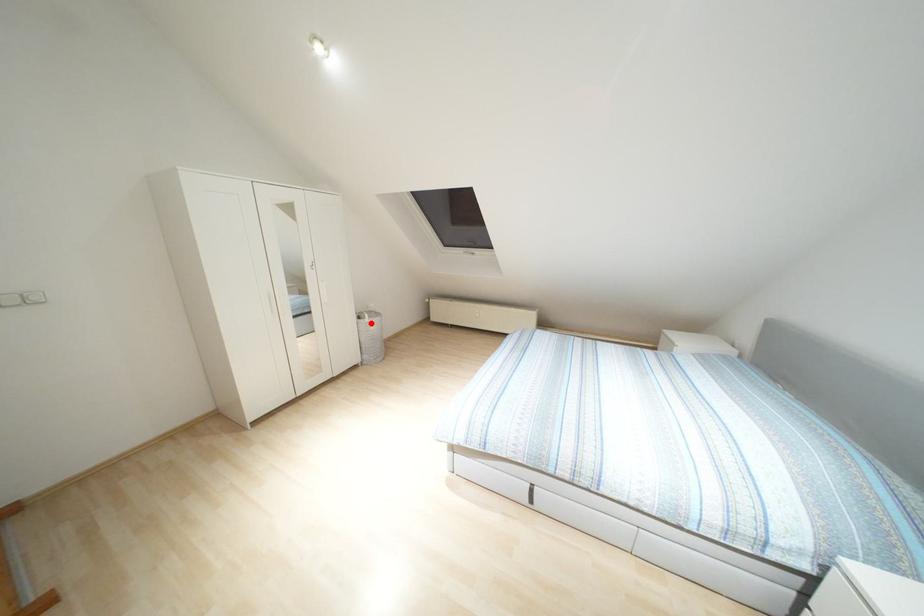
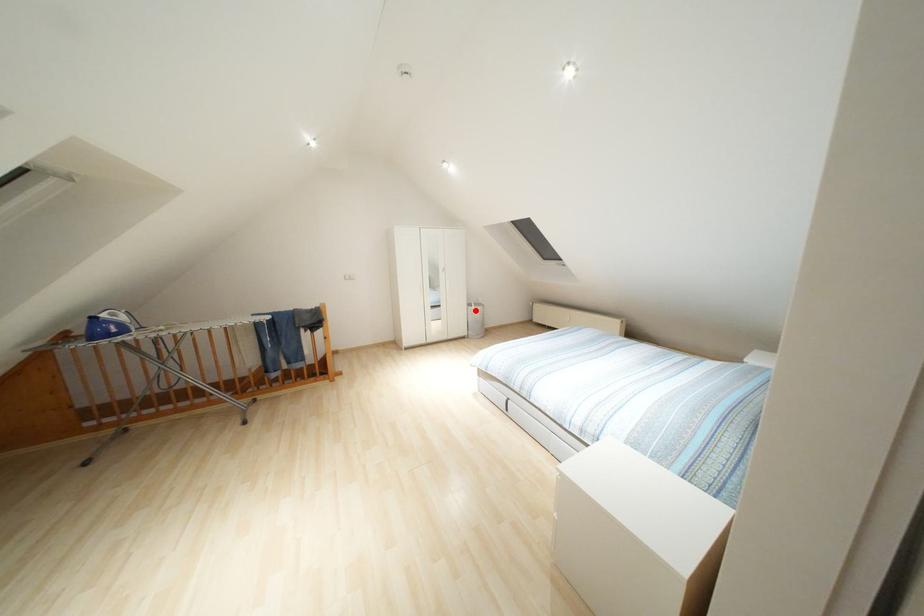
I am providing you with two images of the same scene from different viewpoints. A red point is marked on the first image and another point is marked on the second image. Do the highlighted points in image1 and image2 indicate the same real-world spot?

Yes